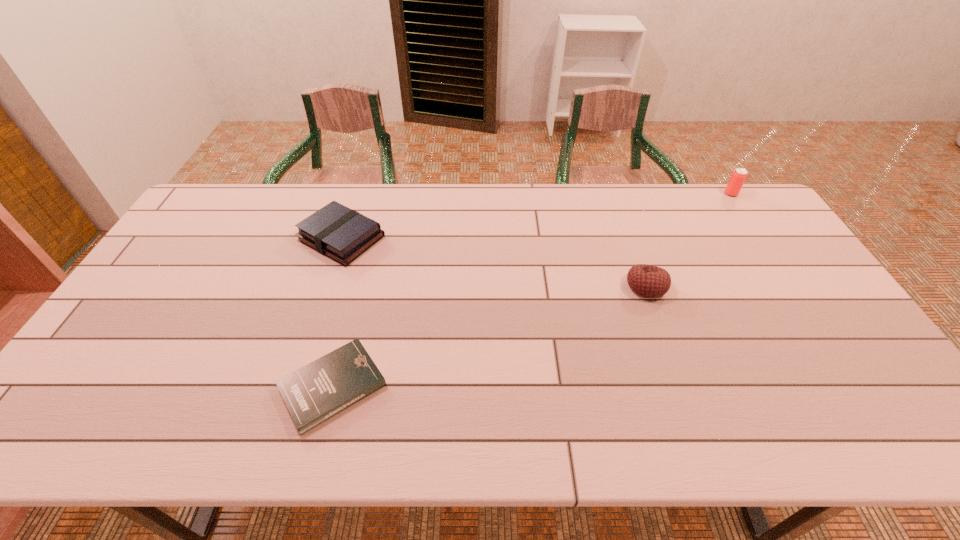
The height and width of the screenshot is (540, 960). What are the coordinates of `the second closest object relative to the second tallest object` in the screenshot? It's located at (314, 393).

Locate an element on the screen. Image resolution: width=960 pixels, height=540 pixels. object identified as the third closest to the tallest object is located at coordinates (314, 393).

Where is `vacant area in the image that satisfies the following two spatial constraints: 1. on the back side of the shorter book; 2. on the left side of the rightmost object`? The width and height of the screenshot is (960, 540). vacant area in the image that satisfies the following two spatial constraints: 1. on the back side of the shorter book; 2. on the left side of the rightmost object is located at coordinates (383, 194).

Identify the location of free space that satisfies the following two spatial constraints: 1. on the back side of the third object from left to right; 2. on the left side of the tallest object. (613, 194).